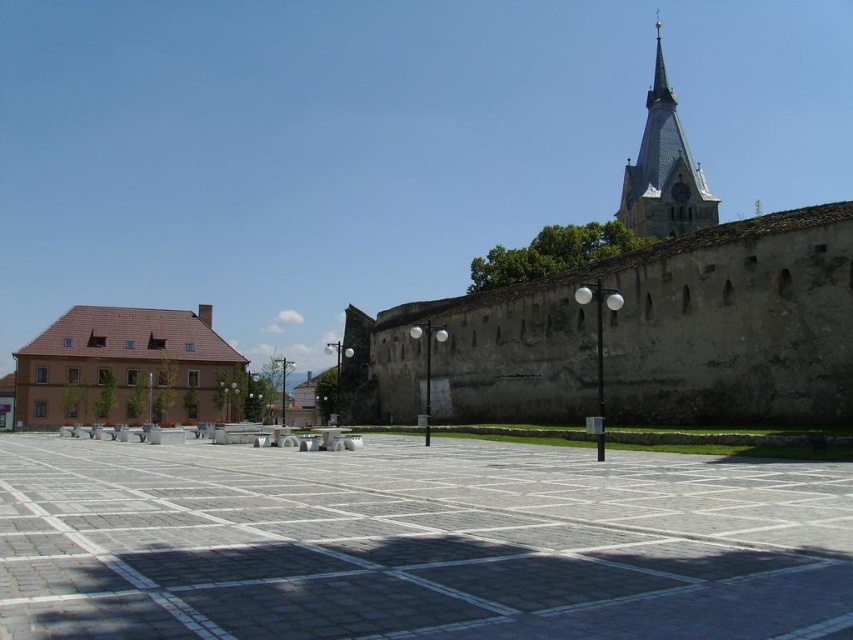
Can you confirm if gray concrete tiles at center is positioned above light brown stone clock tower at upper right?

No, gray concrete tiles at center is not above light brown stone clock tower at upper right.

Identify the location of gray concrete tiles at center. (416, 544).

From the picture: Does brown matte building at left have a smaller size compared to light brown stone clock tower at upper right?

Yes, brown matte building at left is smaller than light brown stone clock tower at upper right.

Is brown matte building at left behind light brown stone clock tower at upper right?

No, brown matte building at left is closer to the viewer.

Locate an element on the screen. Image resolution: width=853 pixels, height=640 pixels. brown matte building at left is located at coordinates tap(126, 369).

Does gray concrete tiles at center appear under brown matte building at left?

Correct, gray concrete tiles at center is located below brown matte building at left.

Measure the distance between gray concrete tiles at center and brown matte building at left.

gray concrete tiles at center and brown matte building at left are 287.72 feet apart from each other.

What do you see at coordinates (416, 544) in the screenshot?
I see `gray concrete tiles at center` at bounding box center [416, 544].

Find the location of a particular element. The height and width of the screenshot is (640, 853). gray concrete tiles at center is located at coordinates (416, 544).